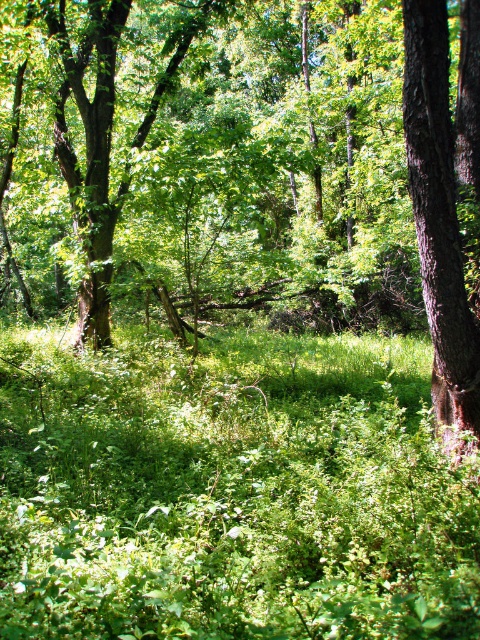
Looking at this image, you are an explorer navigating through the forest. You see a green leafy tree at center and a brown rough bark tree at right. Which tree is closer to you?

The green leafy tree at center is closer to you than the brown rough bark tree at right.

Consider the image. You are a hiker trying to navigate through the forest. You need to pass between the green leafy tree at center and the brown rough bark tree at right. Can you estimate if there is enough space for you to walk through comfortably?

The green leafy tree at center might be wider than brown rough bark tree at right, so there may not be enough space to walk through comfortably. It is advisable to look for another path or proceed with caution.

You are a hiker navigating through the forest and want to find a clear path to the right. Which tree, the green leafy tree at center or the brown rough bark tree at right, is blocking your way?

The green leafy tree at center is positioned over the brown rough bark tree at right, so it is blocking the path to the right.